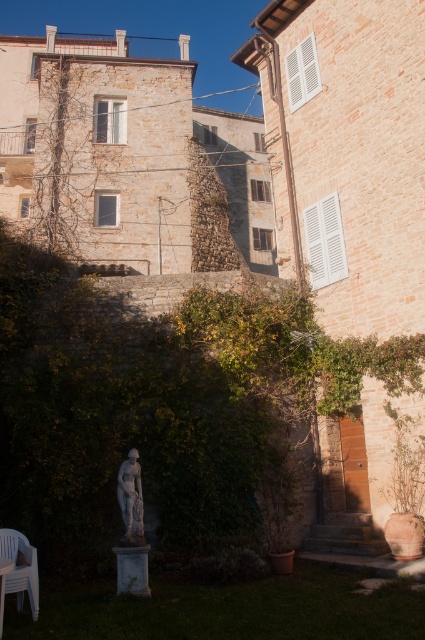
You are a gardener who wants to plant a new shrub between the green leafy hedge at center and the white plastic chair on the left. The shrub requires at least 50 feet of space between them to grow properly. Based on the scene, do you think there is enough space?

The distance between the green leafy hedge at center and the white plastic chair on the left is 49.39 feet, which is slightly less than the required 50 feet. Therefore, there is not enough space to plant the shrub with the necessary distance.

You are standing in the courtyard and want to take a photo of two specific points marked in the image. The first point is at coordinates point (x=28, y=589) and the second is at point (x=127, y=516). Which point should you focus on first if you want to ensure both are in sharp focus without adjusting the camera focus?

You should focus on point (x=28, y=589) first because it is closer to the camera than point (x=127, y=516). By focusing on the closer point, the farther point will still be within the depth of field, ensuring both are in focus without needing to adjust the focus.